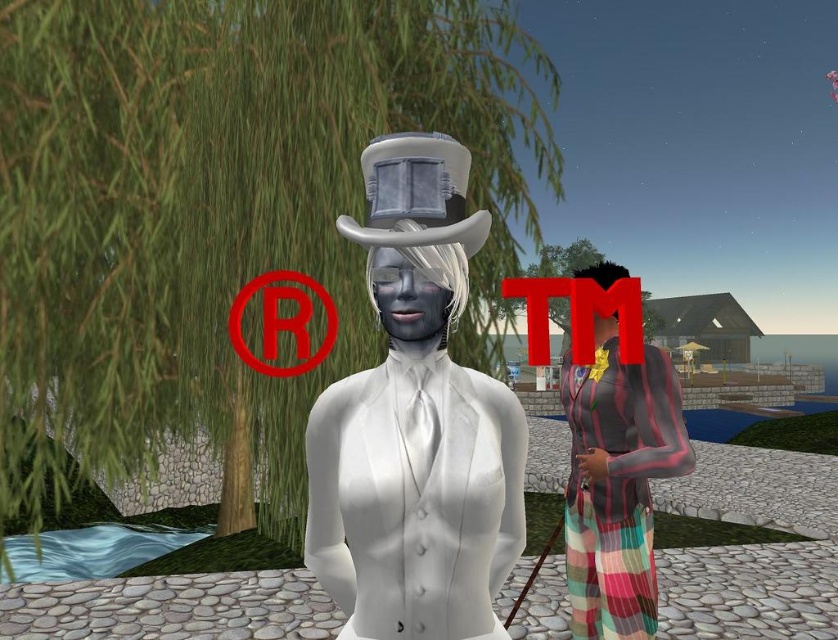
Is white matte suit at center smaller than striped fabric dress at right?

Indeed, white matte suit at center has a smaller size compared to striped fabric dress at right.

The height and width of the screenshot is (640, 838). What do you see at coordinates (415, 422) in the screenshot?
I see `white matte suit at center` at bounding box center [415, 422].

This screenshot has height=640, width=838. Find the location of `white matte suit at center`. white matte suit at center is located at coordinates (415, 422).

Who is shorter, striped fabric dress at right or white matte top hat at center?

white matte top hat at center is shorter.

Who is more distant from viewer, (652, 611) or (458, 227)?

The point (652, 611) is more distant.

Identify the location of striped fabric dress at right. (617, 481).

Is white matte suit at center wider than white matte top hat at center?

Correct, the width of white matte suit at center exceeds that of white matte top hat at center.

Does point (495, 428) come behind point (389, 164)?

That is True.

Is point (335, 225) behind point (361, 154)?

No, it is in front of (361, 154).

I want to click on white matte suit at center, so click(x=415, y=422).